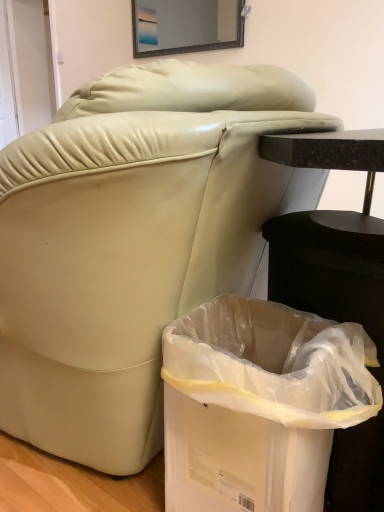
Question: From the image's perspective, is matte glass mirror at upper center located above or below white plastic trash bin at lower right?

Choices:
 (A) below
 (B) above

Answer: (B)

Question: Is point (215, 23) positioned closer to the camera than point (173, 478)?

Choices:
 (A) farther
 (B) closer

Answer: (A)

Question: In terms of height, does matte glass mirror at upper center look taller or shorter compared to white plastic trash bin at lower right?

Choices:
 (A) tall
 (B) short

Answer: (B)

Question: Looking at their shapes, would you say white plastic trash bin at lower right is wider or thinner than matte glass mirror at upper center?

Choices:
 (A) thin
 (B) wide

Answer: (B)

Question: Is white plastic trash bin at lower right spatially inside matte glass mirror at upper center, or outside of it?

Choices:
 (A) outside
 (B) inside

Answer: (A)

Question: From the image's perspective, relative to matte glass mirror at upper center, is white plastic trash bin at lower right above or below?

Choices:
 (A) above
 (B) below

Answer: (B)

Question: In terms of size, does white plastic trash bin at lower right appear bigger or smaller than matte glass mirror at upper center?

Choices:
 (A) big
 (B) small

Answer: (A)